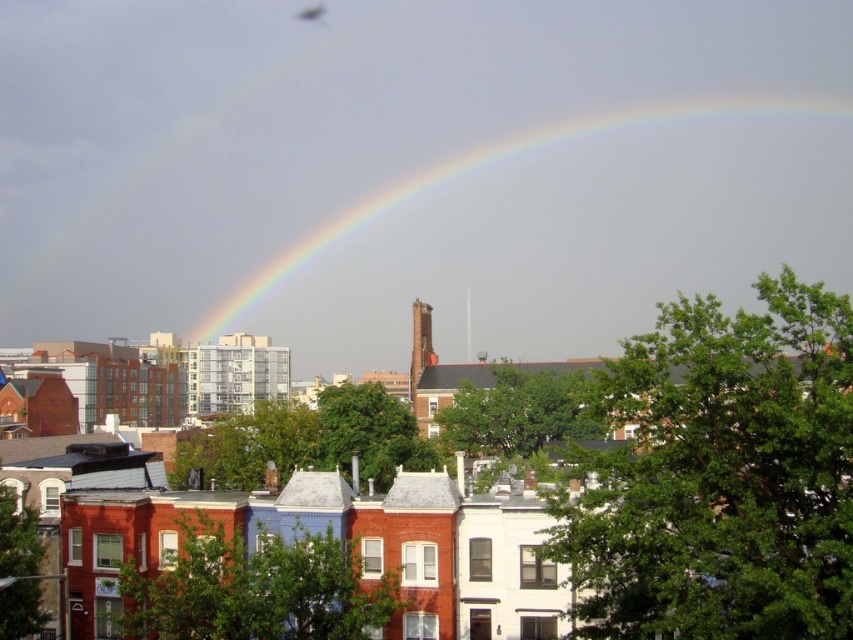
Question: Is rainbow at upper center to the right of translucent glass fly at upper center from the viewer's perspective?

Choices:
 (A) yes
 (B) no

Answer: (A)

Question: Where is rainbow at upper center located in relation to translucent glass fly at upper center in the image?

Choices:
 (A) above
 (B) below

Answer: (B)

Question: Which point is farther from the camera taking this photo?

Choices:
 (A) (202, 324)
 (B) (322, 12)

Answer: (A)

Question: Does rainbow at upper center have a greater width compared to translucent glass fly at upper center?

Choices:
 (A) no
 (B) yes

Answer: (B)

Question: Which object is closer to the camera taking this photo?

Choices:
 (A) translucent glass fly at upper center
 (B) rainbow at upper center

Answer: (B)